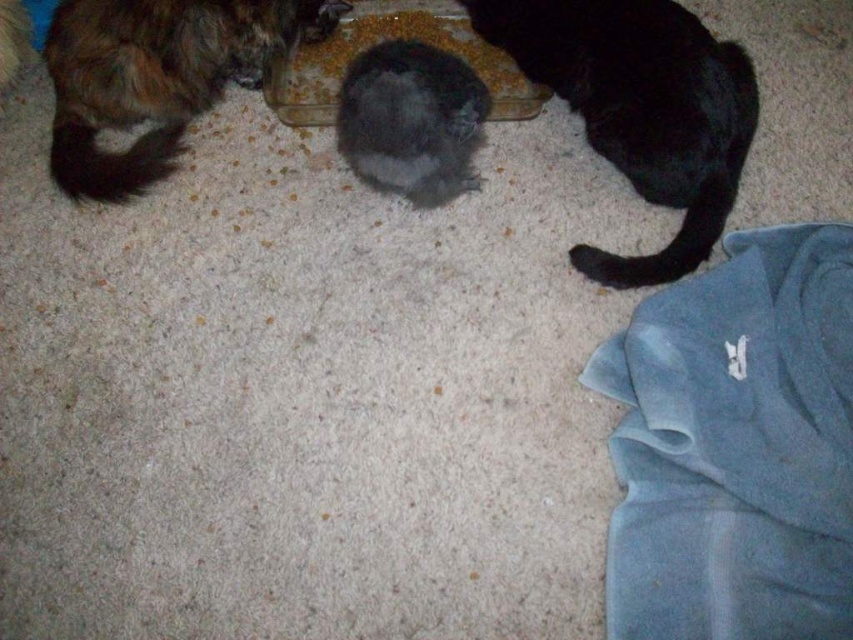
In the scene with the shaggy brown fur cat at upper left and the fluffy black cat at center, which cat is taller?

The shaggy brown fur cat at upper left is much taller than the fluffy black cat at center.

You are a cat owner who wants to place a new toy between the black fur cat at right and the smooth plastic bowl at center. Based on their current positions, which side of the bowl should you place the toy to ensure it stays between them?

The black fur cat at right is positioned on the right side of the smooth plastic bowl at center, so placing the toy to the left side of the bowl would keep it between the black fur cat at right and the smooth plastic bowl at center.